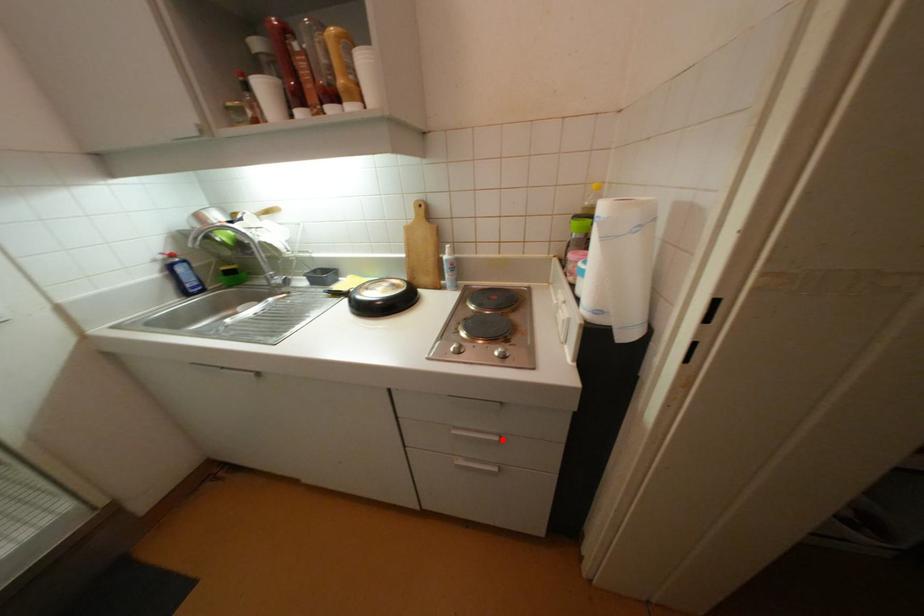
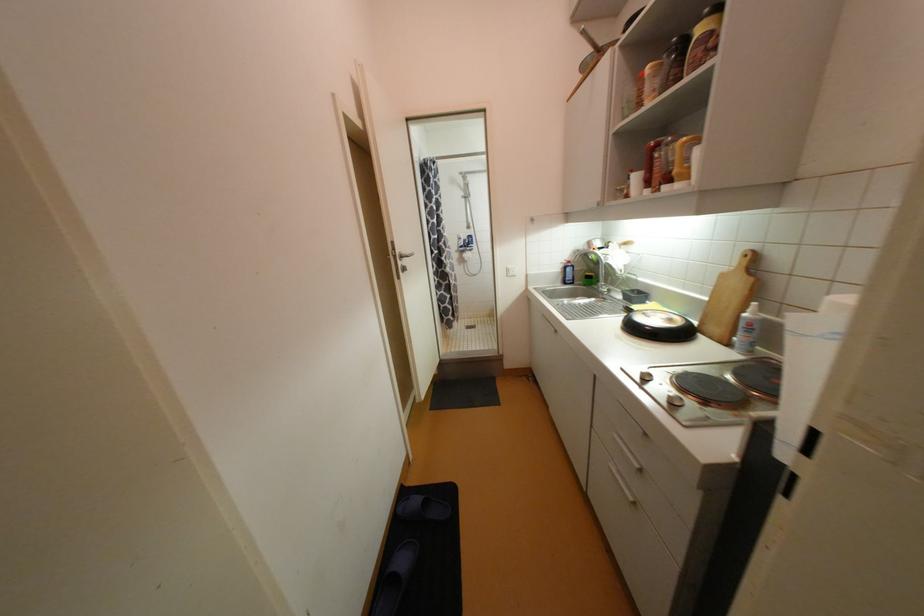
Question: I am providing you with two images of the same scene from different viewpoints. Image1 has a red point marked. In image2, the corresponding 3D location appears at what relative position? Reply with the corresponding letter.

Choices:
 (A) Closer
 (B) Farther

Answer: (A)